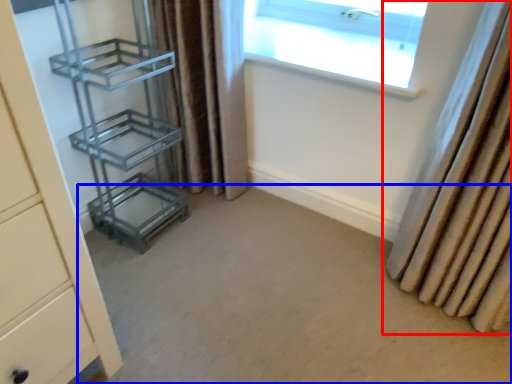
Question: Which point is further to the camera, curtain (highlighted by a red box) or plain (highlighted by a blue box)?

Choices:
 (A) curtain
 (B) plain

Answer: (A)